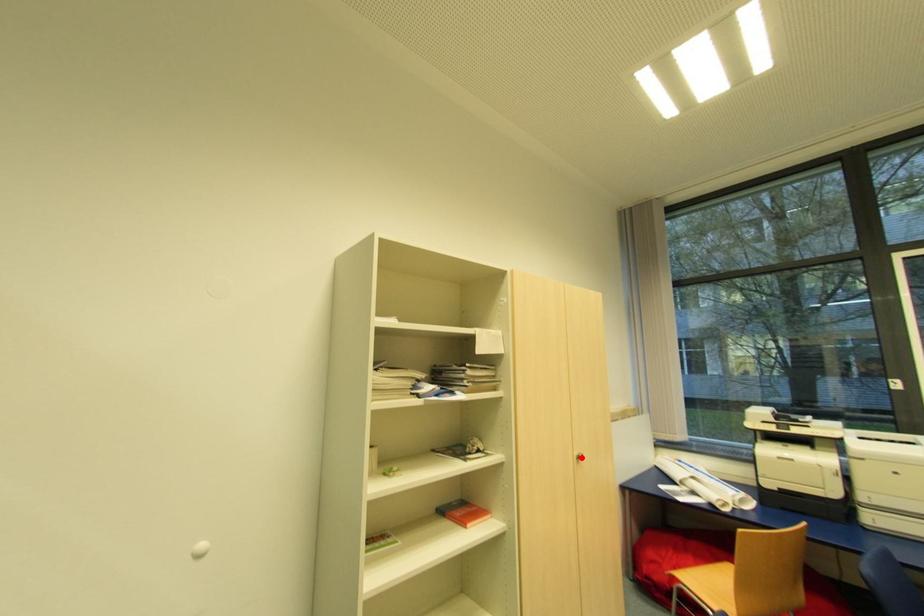
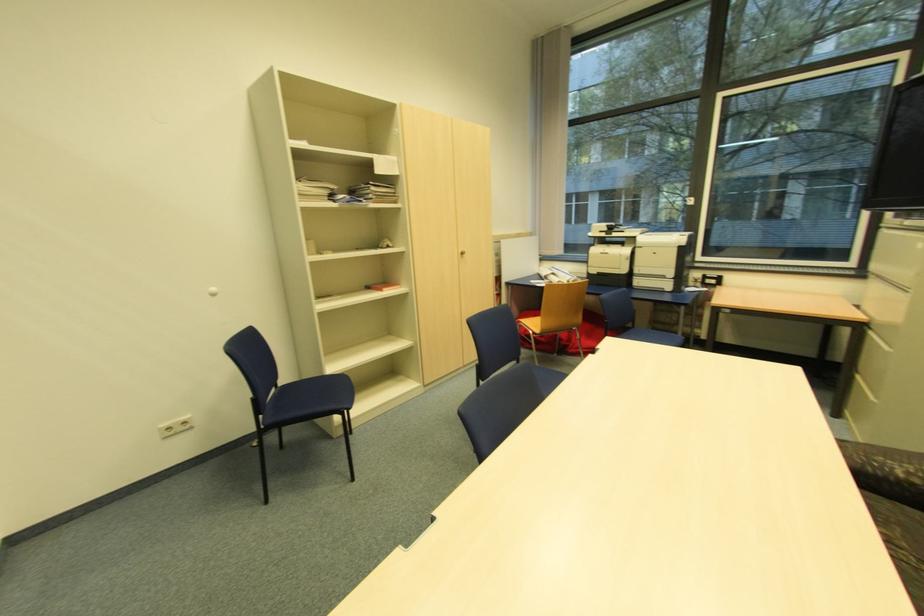
Question: I am providing you with two images of the same scene from different viewpoints. A red point is marked on the first image. Is the red point's position out of view in image 2?

Choices:
 (A) Yes
 (B) No

Answer: (B)